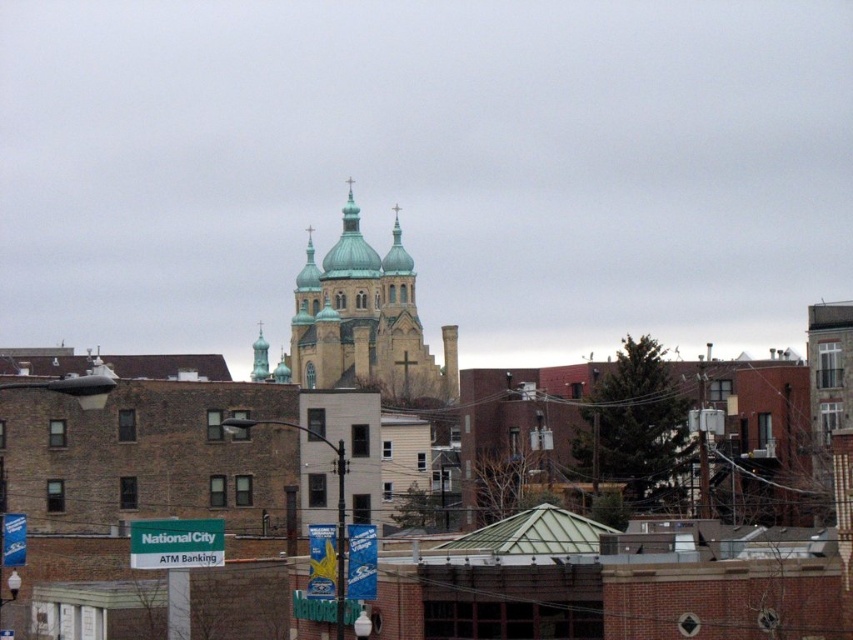
You are standing at the center of the city square and want to locate the stone church at center. According to the coordinates provided, where should you look relative to your current position?

The stone church at center is located at coordinates point 0.927 on the x axis and 0.714 on the y axis, so you should look towards the upper right direction from your current position.

You are an architect analyzing the cityscape. You observe the stone church at center and the green glazed dome at center. Which structure would require a taller support structure to maintain stability?

The stone church at center has a greater height compared to the green glazed dome at center, so it would require a taller support structure to maintain stability.